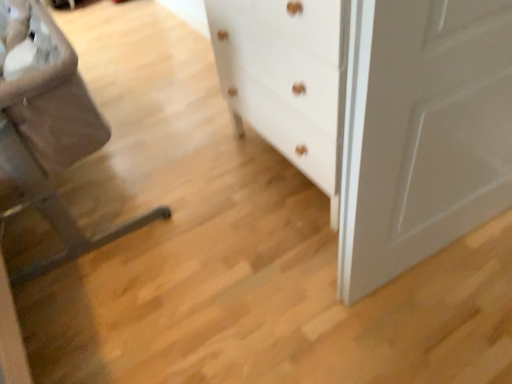
This screenshot has width=512, height=384. I want to click on space that is in front of brown fabric rocking chair at left, so click(127, 312).